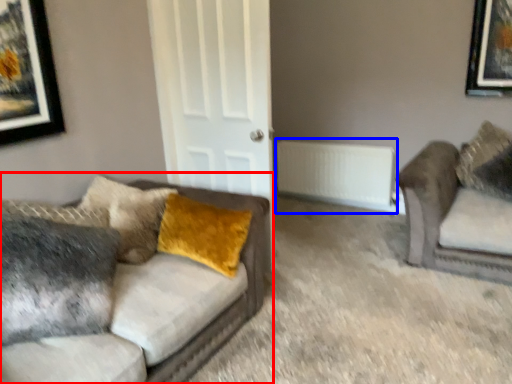
Question: Which point is closer to the camera, studio couch (highlighted by a red box) or radiator (highlighted by a blue box)?

Choices:
 (A) studio couch
 (B) radiator

Answer: (A)